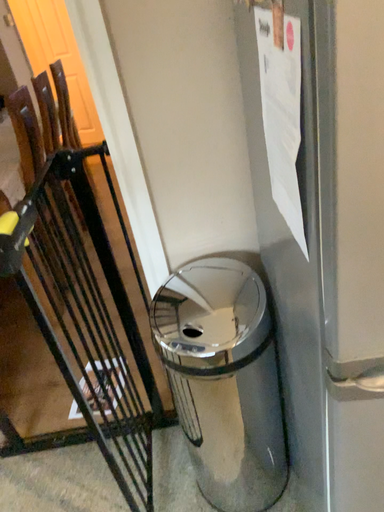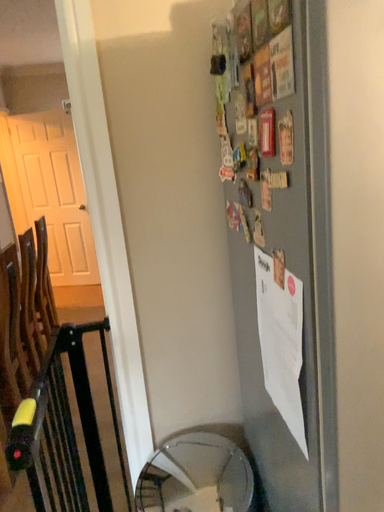
Question: Which way did the camera rotate in the video?

Choices:
 (A) rotated left
 (B) rotated right

Answer: (B)